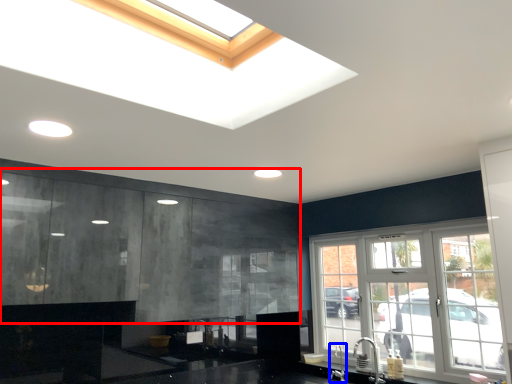
Question: Which object is closer to the camera taking this photo, cabinetry (highlighted by a red box) or faucet (highlighted by a blue box)?

Choices:
 (A) cabinetry
 (B) faucet

Answer: (A)